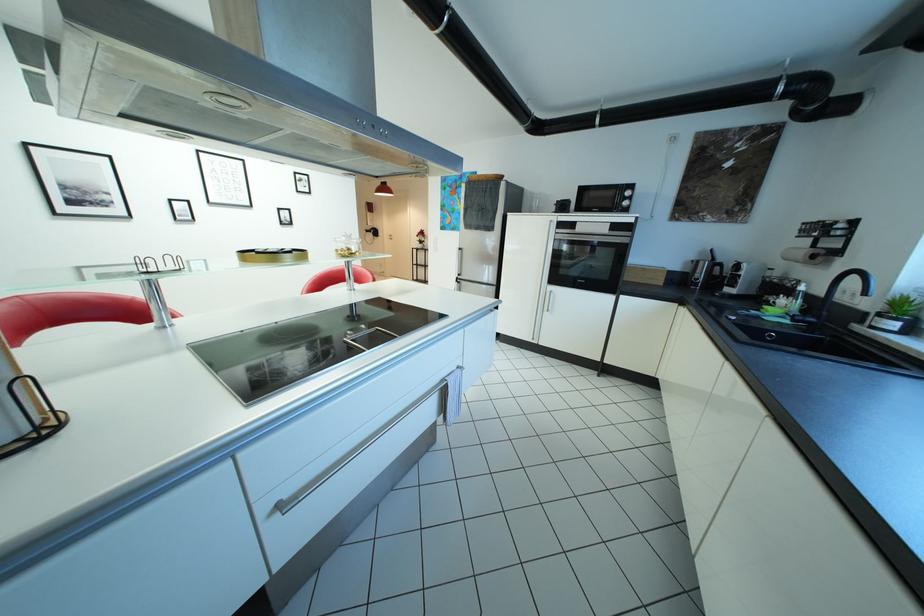
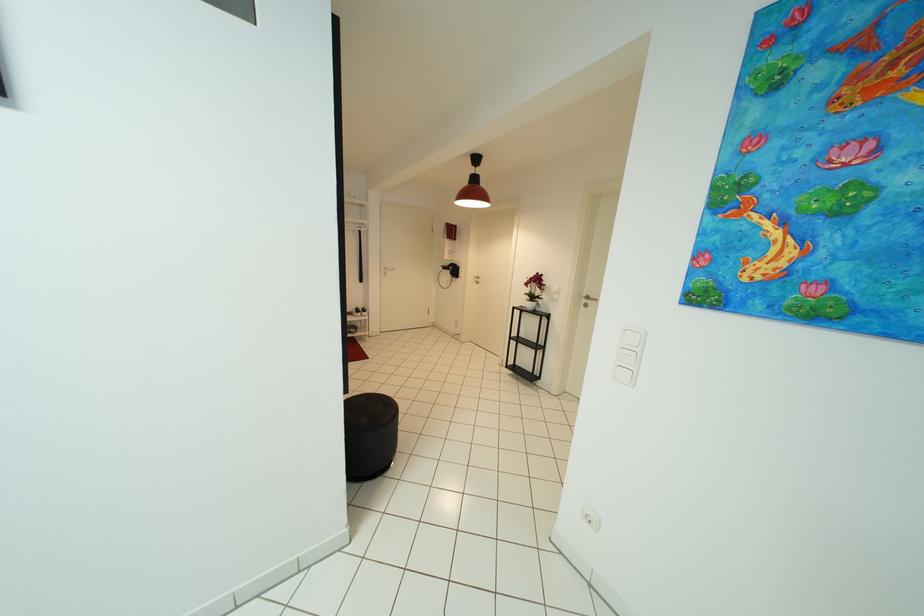
Question: In a continuous first-person perspective shot, in which direction is the camera moving?

Choices:
 (A) Left
 (B) Right
 (C) Forward
 (D) Backward

Answer: (C)